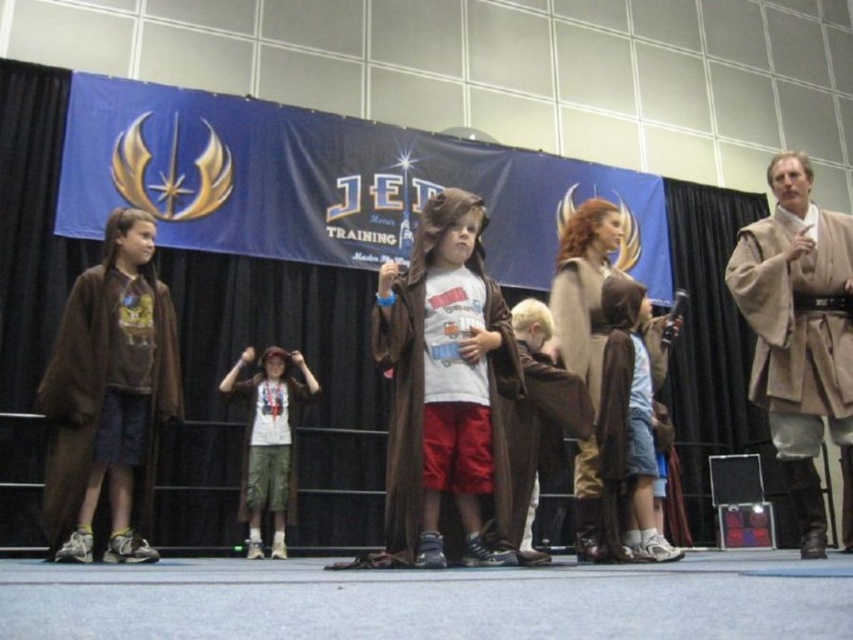
Question: Does beige wool robe at center have a greater width compared to brown suede robe at left?

Choices:
 (A) yes
 (B) no

Answer: (A)

Question: Which of the following is the farthest from the observer?

Choices:
 (A) brown suede robe at center
 (B) brown suede robe at left
 (C) brown suede cape at center
 (D) carpeted floor at lower center

Answer: (B)

Question: Estimate the real-world distances between objects in this image. Which object is farther from the brown suede cloak at center?

Choices:
 (A) beige wool robe at center
 (B) brown suede robe at center
 (C) brown suede cape at center
 (D) carpeted floor at lower center

Answer: (A)

Question: Which point is closer to the camera?

Choices:
 (A) (781, 268)
 (B) (437, 349)

Answer: (B)

Question: Is beige wool robe at center behind brown suede cape at center?

Choices:
 (A) yes
 (B) no

Answer: (A)

Question: From the image, what is the correct spatial relationship of carpeted floor at lower center in relation to brown suede robe at center?

Choices:
 (A) below
 (B) above

Answer: (A)